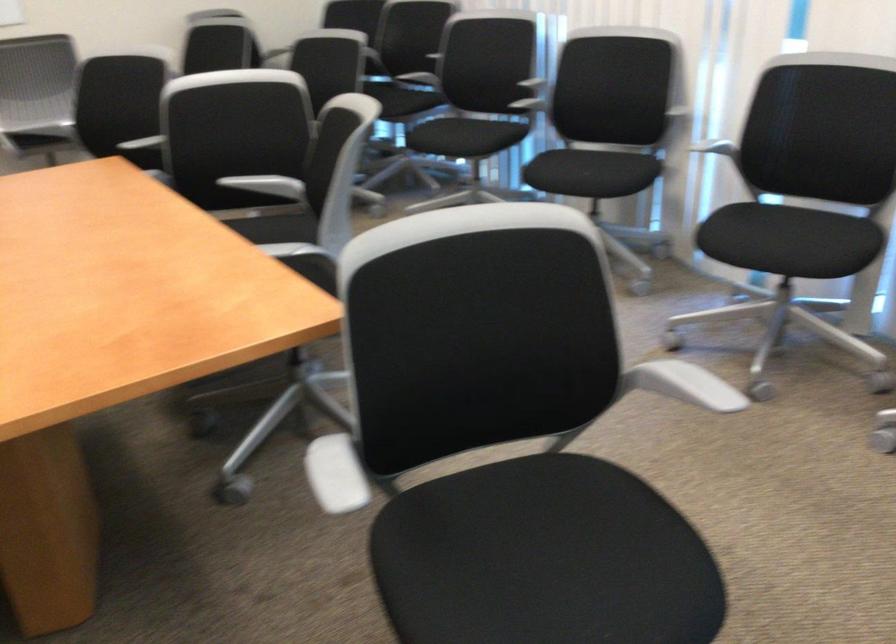
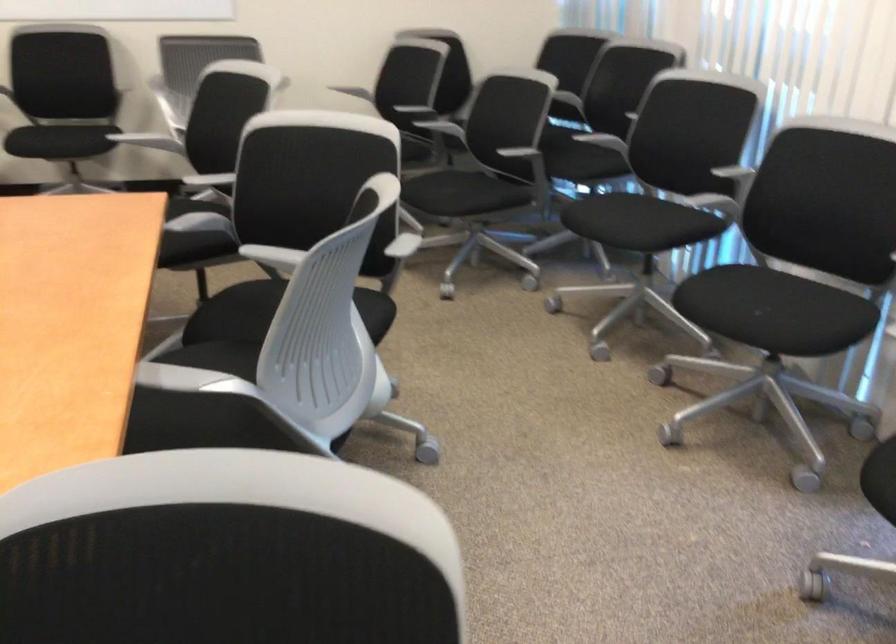
In the second image, find the point that corresponds to point 460,138 in the first image.

(624, 221)